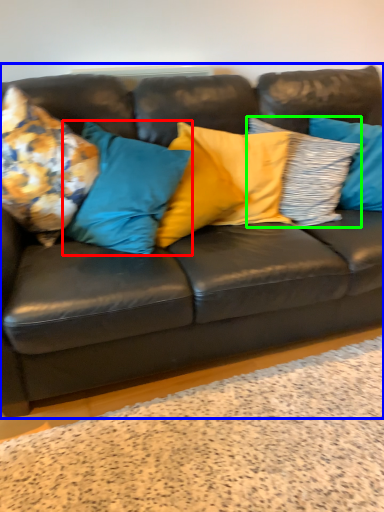
Question: Considering the real-world distances, which object is farthest from pillow (highlighted by a red box)? studio couch (highlighted by a blue box) or pillow (highlighted by a green box)?

Choices:
 (A) studio couch
 (B) pillow

Answer: (B)